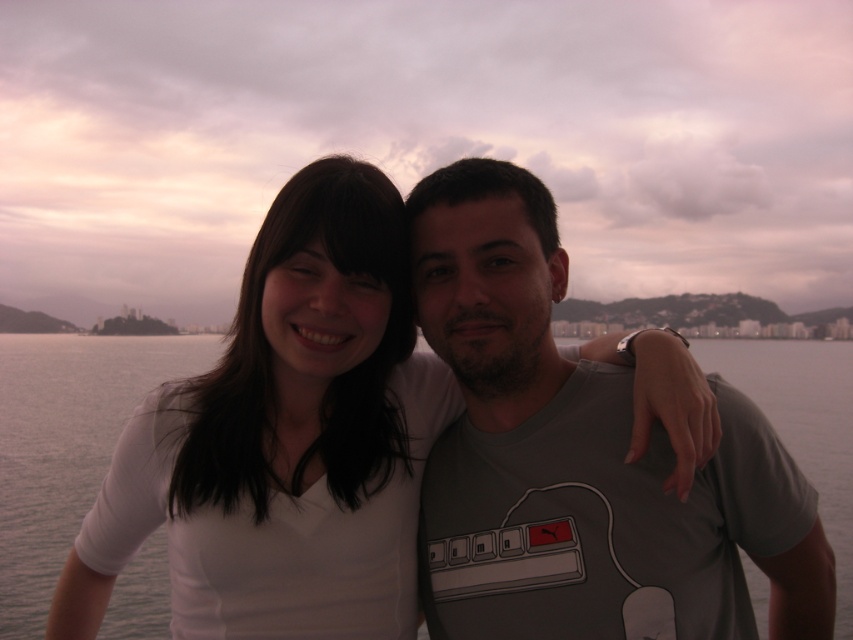
Question: Does gray matte t-shirt at center have a greater width compared to gray water at center?

Choices:
 (A) no
 (B) yes

Answer: (A)

Question: Is gray matte t-shirt at center positioned before gray water at center?

Choices:
 (A) yes
 (B) no

Answer: (A)

Question: Which object is closer to the camera taking this photo?

Choices:
 (A) gray water at center
 (B) gray matte t-shirt at center

Answer: (B)

Question: Which object appears farthest from the camera in this image?

Choices:
 (A) gray water at center
 (B) gray matte t-shirt at center

Answer: (A)

Question: Can you confirm if gray matte t-shirt at center is thinner than gray water at center?

Choices:
 (A) no
 (B) yes

Answer: (B)